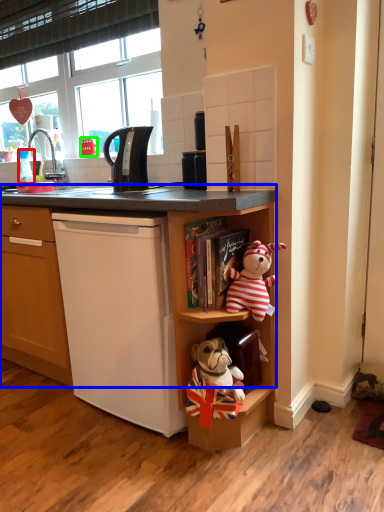
Question: Which is nearer to the coffee cup (highlighted by a red box)? cabinet (highlighted by a blue box) or corded phone (highlighted by a green box).

Choices:
 (A) cabinet
 (B) corded phone

Answer: (B)